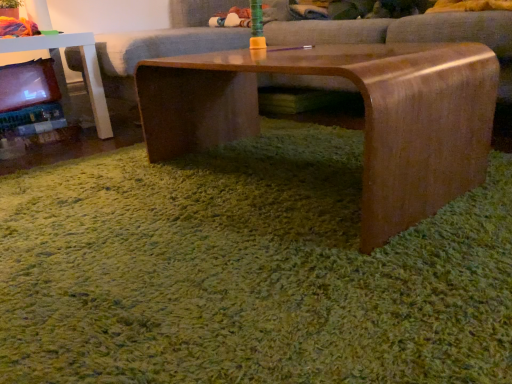
Question: Is matte plastic toy at left at the right side of shiny brown wood coffee table at center?

Choices:
 (A) no
 (B) yes

Answer: (A)

Question: Is matte plastic toy at left facing away from shiny brown wood coffee table at center?

Choices:
 (A) no
 (B) yes

Answer: (A)

Question: Considering the relative sizes of matte plastic toy at left and shiny brown wood coffee table at center in the image provided, is matte plastic toy at left taller than shiny brown wood coffee table at center?

Choices:
 (A) no
 (B) yes

Answer: (B)

Question: Can you confirm if matte plastic toy at left is shorter than shiny brown wood coffee table at center?

Choices:
 (A) no
 (B) yes

Answer: (A)

Question: Does matte plastic toy at left have a larger size compared to shiny brown wood coffee table at center?

Choices:
 (A) no
 (B) yes

Answer: (A)

Question: Is the position of matte plastic toy at left less distant than that of shiny brown wood coffee table at center?

Choices:
 (A) yes
 (B) no

Answer: (B)

Question: Are shiny brown wood coffee table at center and matte brown couch at center far apart?

Choices:
 (A) no
 (B) yes

Answer: (A)

Question: From the image's perspective, is shiny brown wood coffee table at center located above matte brown couch at center?

Choices:
 (A) no
 (B) yes

Answer: (A)

Question: Is shiny brown wood coffee table at center aimed at matte brown couch at center?

Choices:
 (A) yes
 (B) no

Answer: (B)

Question: From the image's perspective, is shiny brown wood coffee table at center located beneath matte brown couch at center?

Choices:
 (A) yes
 (B) no

Answer: (A)

Question: From a real-world perspective, is shiny brown wood coffee table at center positioned over matte brown couch at center based on gravity?

Choices:
 (A) no
 (B) yes

Answer: (A)

Question: Does shiny brown wood coffee table at center have a greater height compared to matte brown couch at center?

Choices:
 (A) yes
 (B) no

Answer: (B)

Question: From the image's perspective, is matte plastic toy at left under green shaggy carpet at center?

Choices:
 (A) no
 (B) yes

Answer: (A)